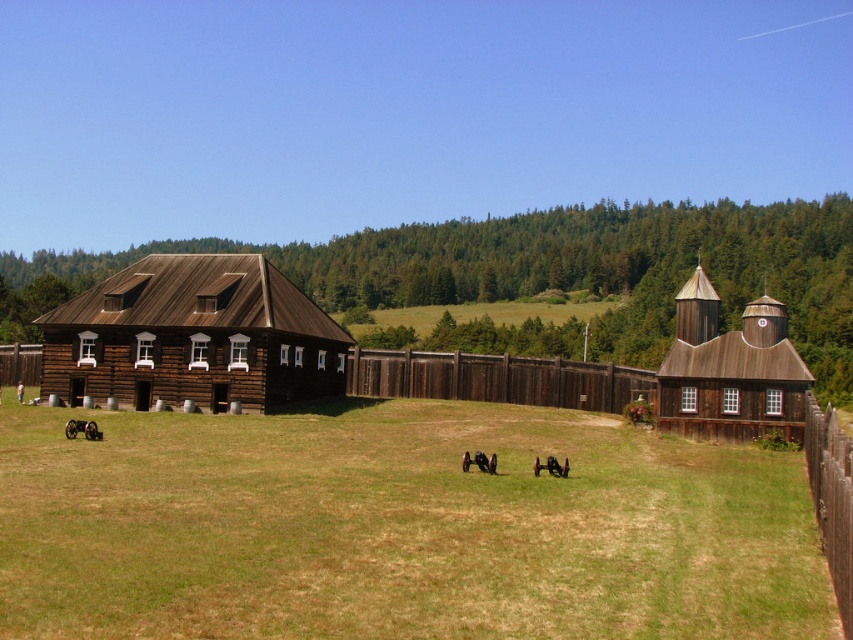
Question: Does green grass at center appear over brown wooden fence at center?

Choices:
 (A) no
 (B) yes

Answer: (A)

Question: Which is farther from the wooden tower at center-right?

Choices:
 (A) brown wooden fence at right
 (B) green grass at center
 (C) brown wooden fence at center
 (D) brown wooden barn at center

Answer: (D)

Question: Which is nearer to the brown wooden barn at center?

Choices:
 (A) brown wooden fence at right
 (B) wooden tower at center-right

Answer: (B)

Question: Can you confirm if green grass at center is wider than brown wooden fence at center?

Choices:
 (A) yes
 (B) no

Answer: (A)

Question: Can you confirm if green grass at center is bigger than brown wooden fence at right?

Choices:
 (A) no
 (B) yes

Answer: (A)

Question: Which point is closer to the camera taking this photo?

Choices:
 (A) (154, 513)
 (B) (746, 388)
 (C) (242, 381)
 (D) (399, 368)

Answer: (A)